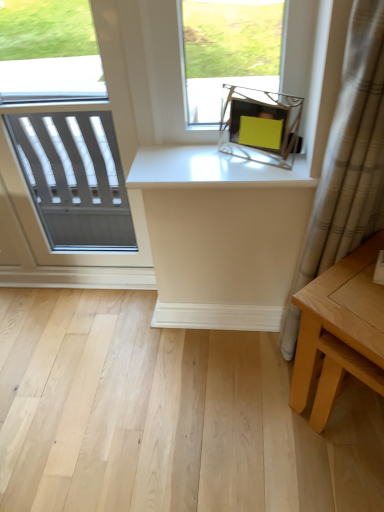
Locate an element on the screen. This screenshot has width=384, height=512. free location to the left of light brown wooden table at lower right is located at coordinates (251, 418).